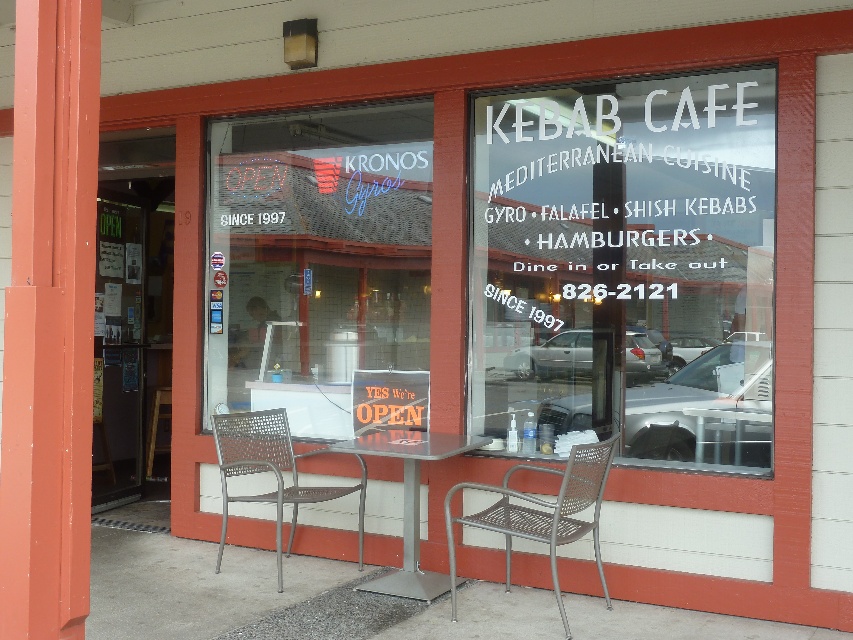
You are a customer standing in front of the Kebab Cafe. You notice both the transparent glass window at center and the transparent glass sign at center. Which one takes up more space in the window?

The transparent glass sign at center takes up more space than the transparent glass window at center because the transparent glass window at center occupies less space than transparent glass sign at center.

You are a delivery person standing at the entrance of the restaurant. You need to place a large box that is 4 meters wide between the metallic mesh chair at lower center and the nearest object. Is there enough space?

The distance between the metallic mesh chair at lower center and the nearest object is 4.31 meters. Since the box is 4 meters wide, there is enough space to place it between them.